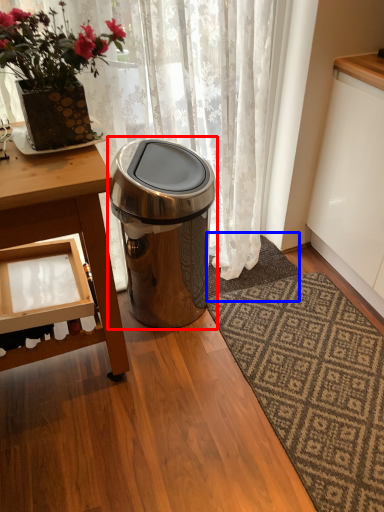
Question: Which point is closer to the camera, trash bin/can (highlighted by a red box) or doormat (highlighted by a blue box)?

Choices:
 (A) trash bin/can
 (B) doormat

Answer: (A)